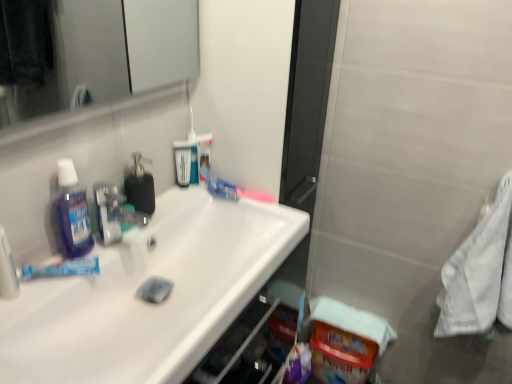
The width and height of the screenshot is (512, 384). Identify the location of vacant region in front of pink plastic toothbrush at upper center, marked as the second toothbrush in a left-to-right arrangement. (249, 217).